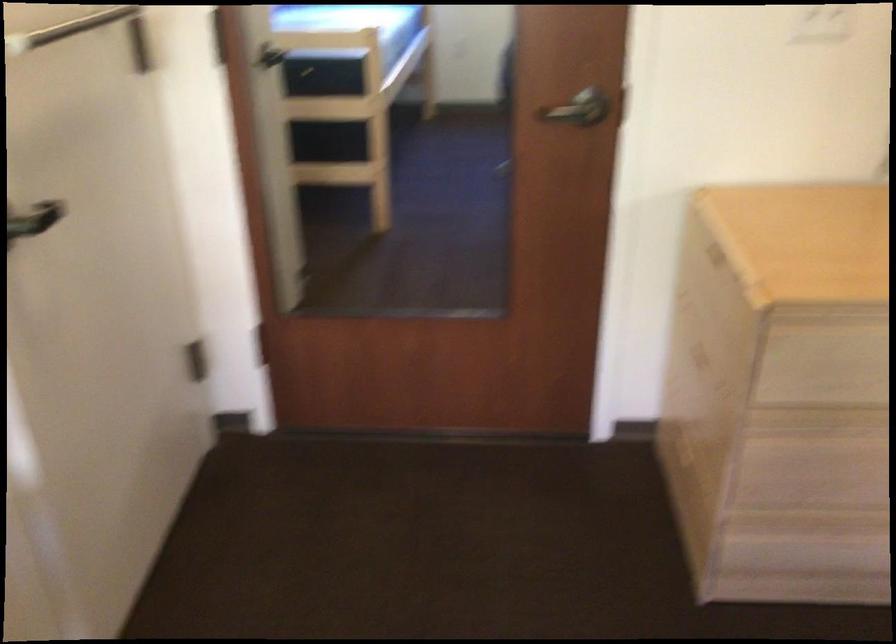
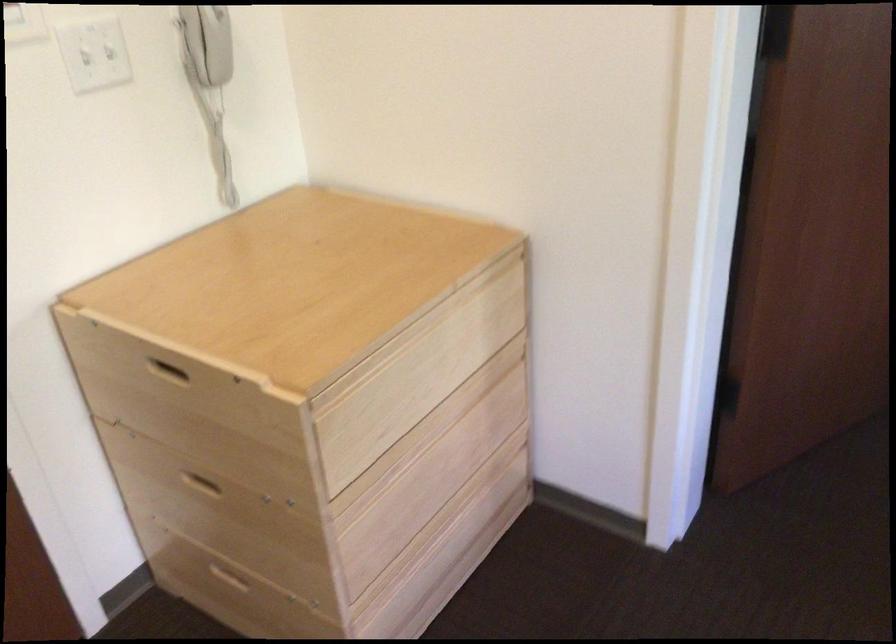
The point at (714, 257) is marked in the first image. Where is the corresponding point in the second image?

(168, 372)